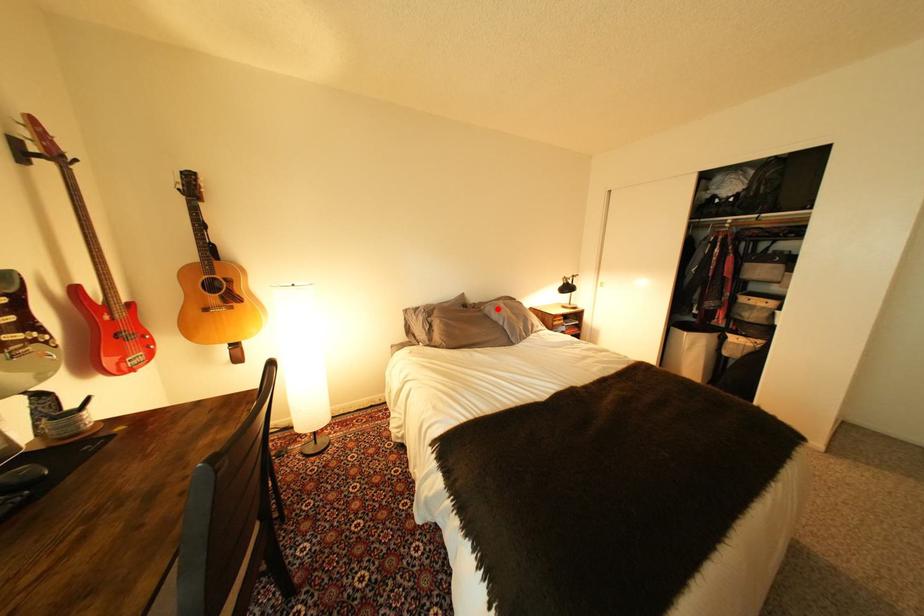
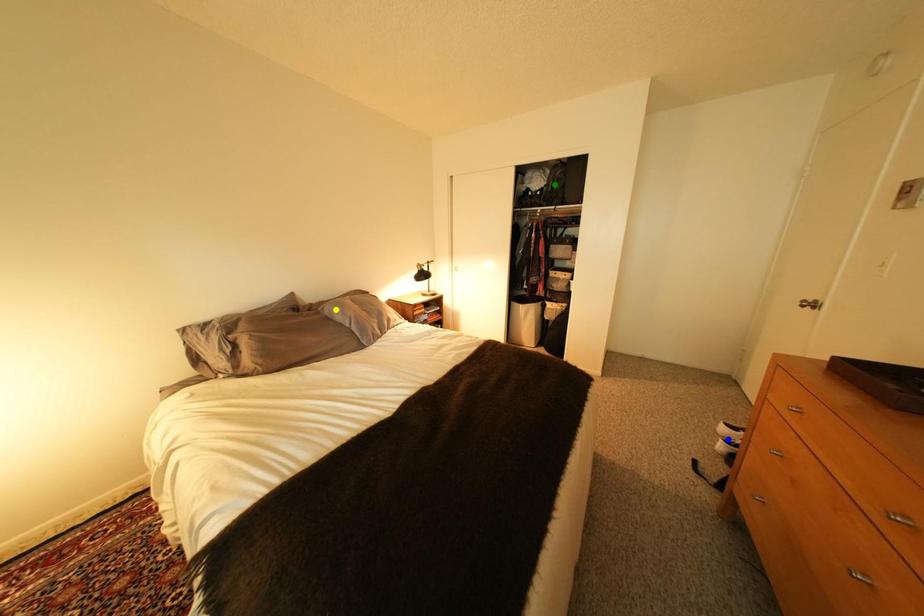
Question: I am providing you with two images of the same scene from different viewpoints. A red point is marked on the first image. You are given multiple points on the second image. Which point in image 2 represents the same 3d spot as the red point in image 1?

Choices:
 (A) green point
 (B) blue point
 (C) yellow point

Answer: (C)